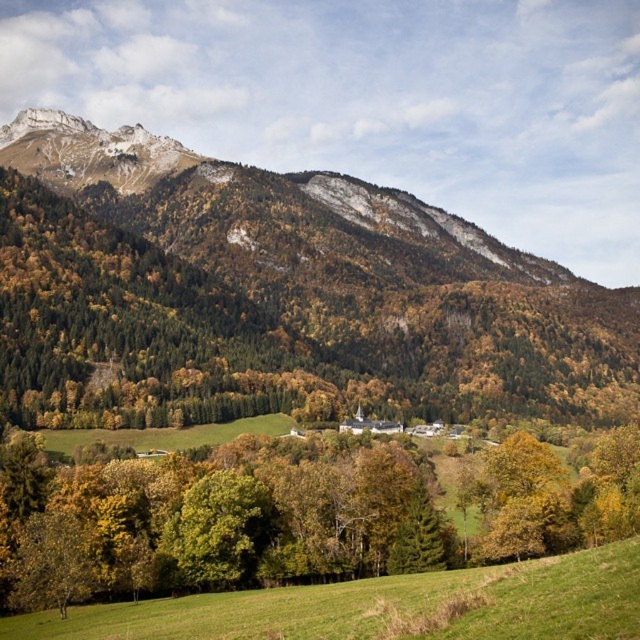
Question: Can you confirm if green forested mountain at upper center is smaller than green matte tree at center?

Choices:
 (A) yes
 (B) no

Answer: (B)

Question: Among these points, which one is farthest from the camera?

Choices:
 (A) (305, 180)
 (B) (621, 429)
 (C) (468, 625)

Answer: (A)

Question: Which object appears closest to the camera in this image?

Choices:
 (A) green forested mountain at upper center
 (B) green matte tree at center
 (C) green grassy field at lower center

Answer: (C)

Question: Which object is farther from the camera taking this photo?

Choices:
 (A) green grassy field at lower center
 (B) green forested mountain at upper center
 (C) green matte tree at center

Answer: (B)

Question: Is green forested mountain at upper center wider than green grassy field at lower center?

Choices:
 (A) no
 (B) yes

Answer: (B)

Question: Can you confirm if green forested mountain at upper center is thinner than green matte tree at center?

Choices:
 (A) no
 (B) yes

Answer: (A)